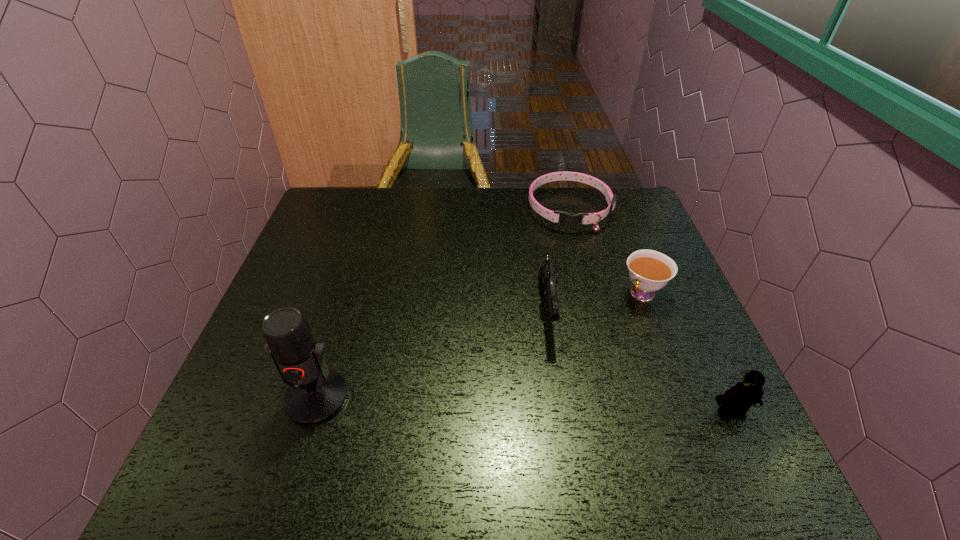
I want to click on free space at the far right corner, so click(628, 201).

Identify the location of free point between the gun and the tallest object. (432, 354).

Find the location of a particular element. Image resolution: width=960 pixels, height=540 pixels. empty space that is in between the Lego and the second shortest object is located at coordinates (686, 353).

In order to click on vacant space that is in between the farthest object and the microphone in this screenshot , I will do tap(444, 303).

This screenshot has height=540, width=960. What are the coordinates of `free spot between the gun and the Lego` in the screenshot? It's located at (638, 361).

Identify the location of empty space between the microphone and the gun. (432, 354).

Find the location of a particular element. Image resolution: width=960 pixels, height=540 pixels. vacant area that lies between the tallest object and the gun is located at coordinates (432, 354).

Where is `vacant point located between the leftmost object and the Lego`? vacant point located between the leftmost object and the Lego is located at coordinates (524, 406).

Where is `free space that is in between the Lego and the second shortest object`? free space that is in between the Lego and the second shortest object is located at coordinates (686, 353).

The height and width of the screenshot is (540, 960). I want to click on vacant area between the dog collar and the leftmost object, so click(444, 303).